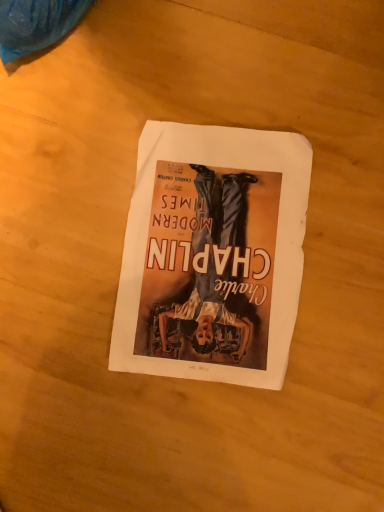
In order to click on free spot above white paper at center (from a real-world perspective) in this screenshot , I will do `click(217, 246)`.